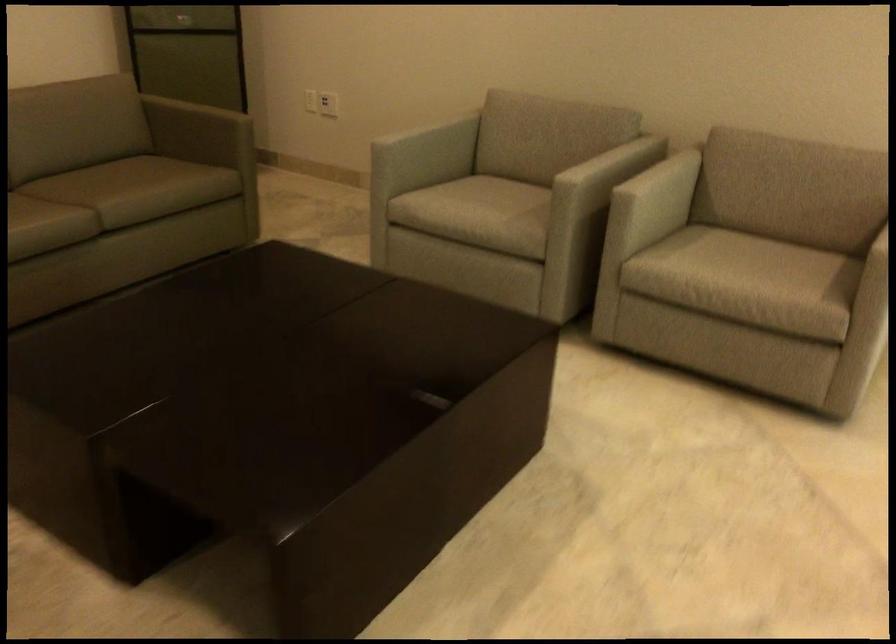
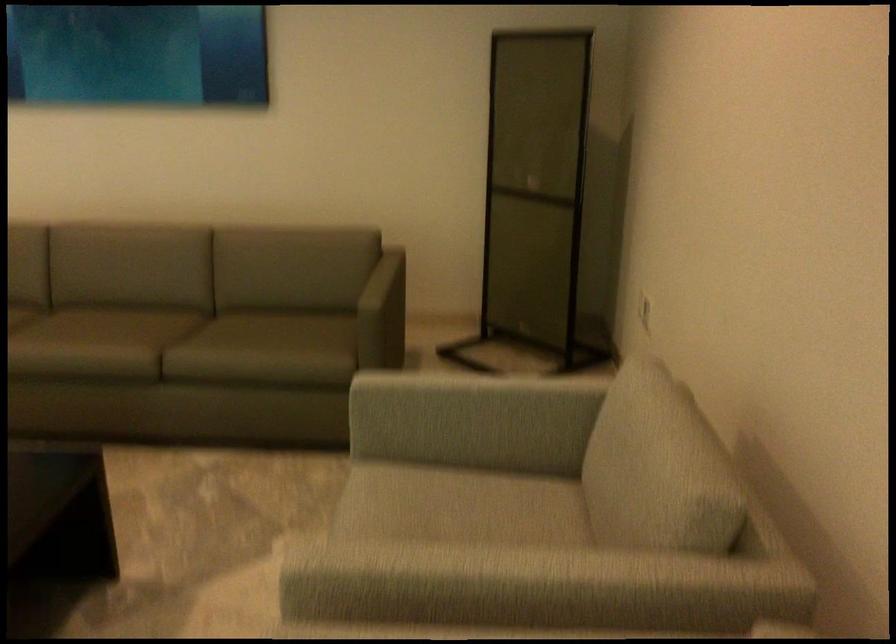
Question: I am providing you with two images of the same scene from different viewpoints. Which of the following objects are not visible in image2?

Choices:
 (A) white electrical outlet
 (B) sofa armrest
 (C) grey sofa cushion
 (D) clear sign holder

Answer: (A)